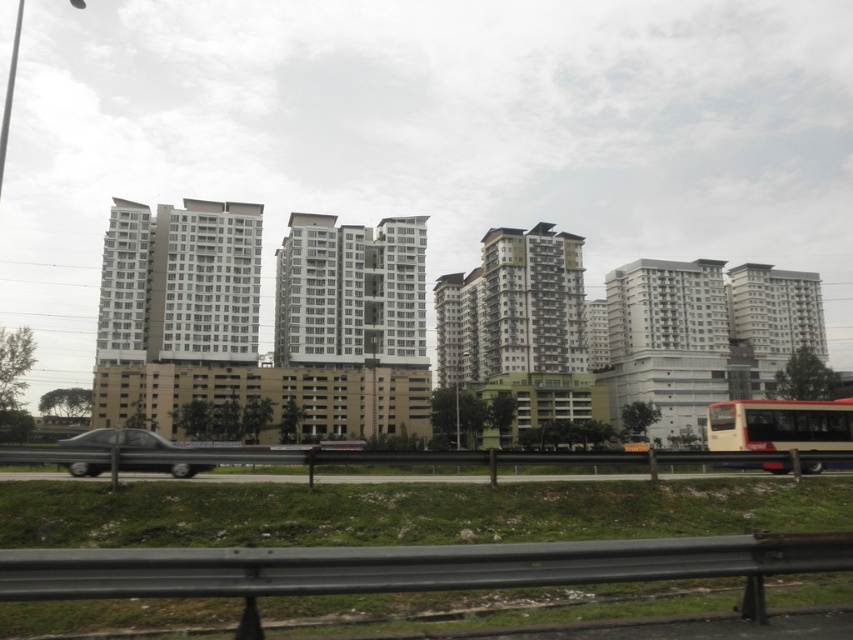
Is yellow matte bus at lower right wider than metallic silver car at lower left?

No.

Is point (724, 438) positioned after point (160, 448)?

Yes, it is behind point (160, 448).

This screenshot has width=853, height=640. Identify the location of yellow matte bus at lower right. (779, 426).